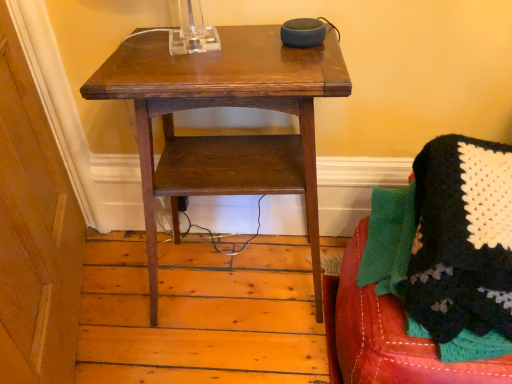
Question: From a real-world perspective, is knitted fabric blanket at lower right above or below wooden table at center?

Choices:
 (A) below
 (B) above

Answer: (B)

Question: In the image, is knitted fabric blanket at lower right positioned in front of or behind wooden table at center?

Choices:
 (A) front
 (B) behind

Answer: (A)

Question: Is knitted fabric blanket at lower right spatially inside wooden table at center, or outside of it?

Choices:
 (A) outside
 (B) inside

Answer: (A)

Question: Is point (261, 94) positioned closer to the camera than point (435, 278)?

Choices:
 (A) farther
 (B) closer

Answer: (A)

Question: Considering the positions of wooden table at center and knitted fabric blanket at lower right in the image, is wooden table at center bigger or smaller than knitted fabric blanket at lower right?

Choices:
 (A) big
 (B) small

Answer: (A)

Question: Is wooden table at center inside or outside of knitted fabric blanket at lower right?

Choices:
 (A) outside
 (B) inside

Answer: (A)

Question: From a real-world perspective, relative to knitted fabric blanket at lower right, is wooden table at center vertically above or below?

Choices:
 (A) above
 (B) below

Answer: (B)